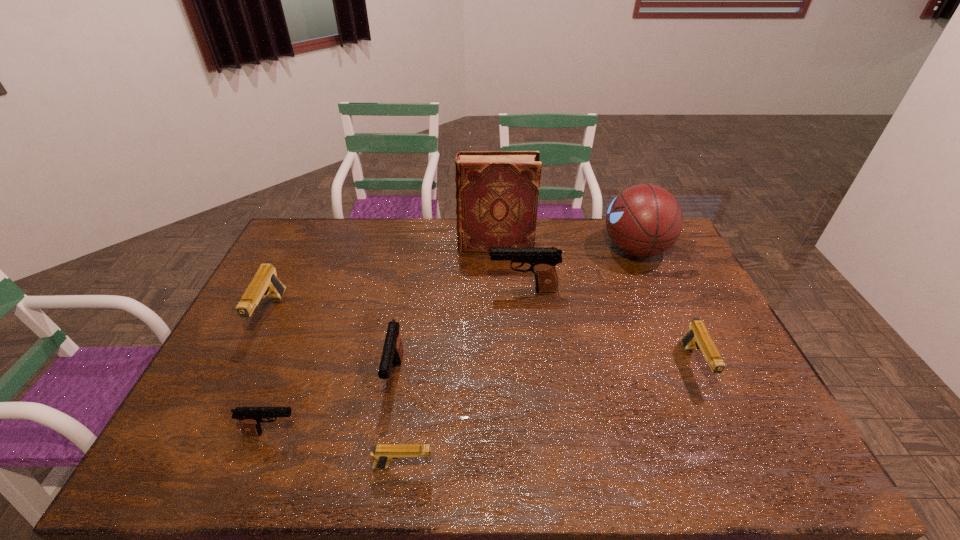
Locate an element on the screen. The image size is (960, 540). pistol that is at the right edge is located at coordinates (697, 336).

The height and width of the screenshot is (540, 960). What are the coordinates of `object that is at the far right corner` in the screenshot? It's located at (644, 220).

The image size is (960, 540). In the image, there is a desktop. Identify the location of vacant area at the far edge. (424, 226).

You are a GUI agent. You are given a task and a screenshot of the screen. Output one action in this format:
    pyautogui.click(x=<x>, y=<y>)
    Task: Click on the blank area at the near edge
    The height and width of the screenshot is (540, 960).
    Given the screenshot: What is the action you would take?
    pyautogui.click(x=691, y=464)

In the image, there is a desktop. At what (x,y) coordinates should I click in order to perform the action: click on vacant region at the left edge. Please return your answer as a coordinate pair (x, y). Image resolution: width=960 pixels, height=540 pixels. Looking at the image, I should click on (262, 392).

Find the location of a particular element. The width and height of the screenshot is (960, 540). free region at the right edge is located at coordinates (723, 378).

This screenshot has width=960, height=540. In the image, there is a desktop. Identify the location of vacant space at the far left corner. (337, 219).

Where is `blank area at the near right corner`? blank area at the near right corner is located at coordinates (745, 449).

Identify the location of vacant space that is in between the seventh farthest object and the second black pistol from right to left. The image size is (960, 540). (334, 404).

Where is `free area in between the leftmost tan pistol and the hardback book`? The image size is (960, 540). free area in between the leftmost tan pistol and the hardback book is located at coordinates (383, 280).